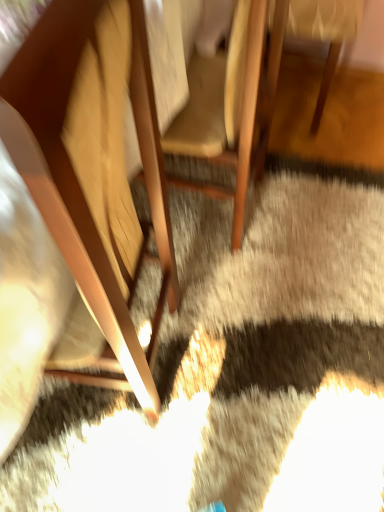
Question: Considering the relative positions of wooden chair at center, the second chair in the right-to-left sequence, and wooden chair at center, placed as the third chair when sorted from left to right, in the image provided, is wooden chair at center, the second chair in the right-to-left sequence, to the right of wooden chair at center, placed as the third chair when sorted from left to right, from the viewer's perspective?

Choices:
 (A) yes
 (B) no

Answer: (B)

Question: Considering the relative sizes of wooden chair at center, the second chair in the right-to-left sequence, and wooden chair at center, the 1th chair positioned from the right, in the image provided, is wooden chair at center, the second chair in the right-to-left sequence, bigger than wooden chair at center, the 1th chair positioned from the right,?

Choices:
 (A) no
 (B) yes

Answer: (B)

Question: Considering the relative sizes of wooden chair at center, the second chair in the right-to-left sequence, and wooden chair at center, the 1th chair positioned from the right, in the image provided, is wooden chair at center, the second chair in the right-to-left sequence, taller than wooden chair at center, the 1th chair positioned from the right,?

Choices:
 (A) yes
 (B) no

Answer: (A)

Question: Considering the relative positions of wooden chair at center, which appears as the second chair when viewed from the left, and wooden chair at center, the 1th chair positioned from the right, in the image provided, is wooden chair at center, which appears as the second chair when viewed from the left, to the left of wooden chair at center, the 1th chair positioned from the right, from the viewer's perspective?

Choices:
 (A) no
 (B) yes

Answer: (B)

Question: Would you say wooden chair at center, placed as the third chair when sorted from left to right, is part of wooden chair at center, the second chair in the right-to-left sequence,'s contents?

Choices:
 (A) no
 (B) yes

Answer: (A)

Question: Considering the positions of wooden chair at left, which is the third chair in right-to-left order, and wooden chair at center, which appears as the second chair when viewed from the left, in the image, is wooden chair at left, which is the third chair in right-to-left order, wider or thinner than wooden chair at center, which appears as the second chair when viewed from the left,?

Choices:
 (A) thin
 (B) wide

Answer: (A)

Question: Is wooden chair at left, which is the third chair in right-to-left order, taller or shorter than wooden chair at center, which appears as the second chair when viewed from the left?

Choices:
 (A) short
 (B) tall

Answer: (B)

Question: Is point (132, 368) closer or farther from the camera than point (243, 187)?

Choices:
 (A) farther
 (B) closer

Answer: (B)

Question: Considering their positions, is wooden chair at left, which is the third chair in right-to-left order, located in front of or behind wooden chair at center, which appears as the second chair when viewed from the left?

Choices:
 (A) front
 (B) behind

Answer: (A)

Question: Considering the positions of wooden chair at center, which appears as the second chair when viewed from the left, and wooden chair at left, which is the third chair in right-to-left order, in the image, is wooden chair at center, which appears as the second chair when viewed from the left, taller or shorter than wooden chair at left, which is the third chair in right-to-left order,?

Choices:
 (A) short
 (B) tall

Answer: (A)

Question: From a real-world perspective, relative to wooden chair at left, which is the third chair in right-to-left order, is wooden chair at center, which appears as the second chair when viewed from the left, vertically above or below?

Choices:
 (A) below
 (B) above

Answer: (A)

Question: Considering the positions of point (241, 91) and point (120, 358), is point (241, 91) closer or farther from the camera than point (120, 358)?

Choices:
 (A) closer
 (B) farther

Answer: (B)

Question: Which is correct: wooden chair at center, which appears as the second chair when viewed from the left, is inside wooden chair at left, which is the third chair in right-to-left order, or outside of it?

Choices:
 (A) inside
 (B) outside

Answer: (B)

Question: From the image's perspective, is wooden chair at center, the second chair in the right-to-left sequence, located above or below wooden chair at center, the 1th chair positioned from the right?

Choices:
 (A) above
 (B) below

Answer: (B)

Question: Is point (195, 135) closer or farther from the camera than point (342, 22)?

Choices:
 (A) closer
 (B) farther

Answer: (A)